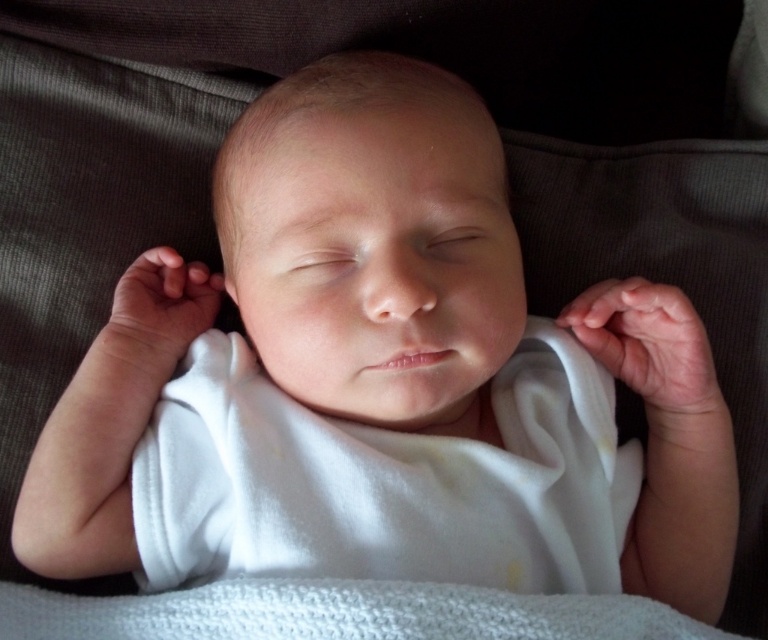
Question: Which point is closer to the camera?

Choices:
 (A) smooth white baby at center
 (B) white knitted blanket at center

Answer: (B)

Question: Is smooth white baby at center bigger than white knitted blanket at center?

Choices:
 (A) yes
 (B) no

Answer: (A)

Question: Considering the relative positions of smooth white baby at center and white knitted blanket at center in the image provided, where is smooth white baby at center located with respect to white knitted blanket at center?

Choices:
 (A) right
 (B) left

Answer: (A)

Question: Does smooth white baby at center appear over white knitted blanket at center?

Choices:
 (A) no
 (B) yes

Answer: (B)

Question: Which object is closer to the camera taking this photo?

Choices:
 (A) smooth white baby at center
 (B) white knitted blanket at center

Answer: (B)

Question: Which of the following is the closest to the observer?

Choices:
 (A) white knitted blanket at center
 (B) smooth white baby at center

Answer: (A)